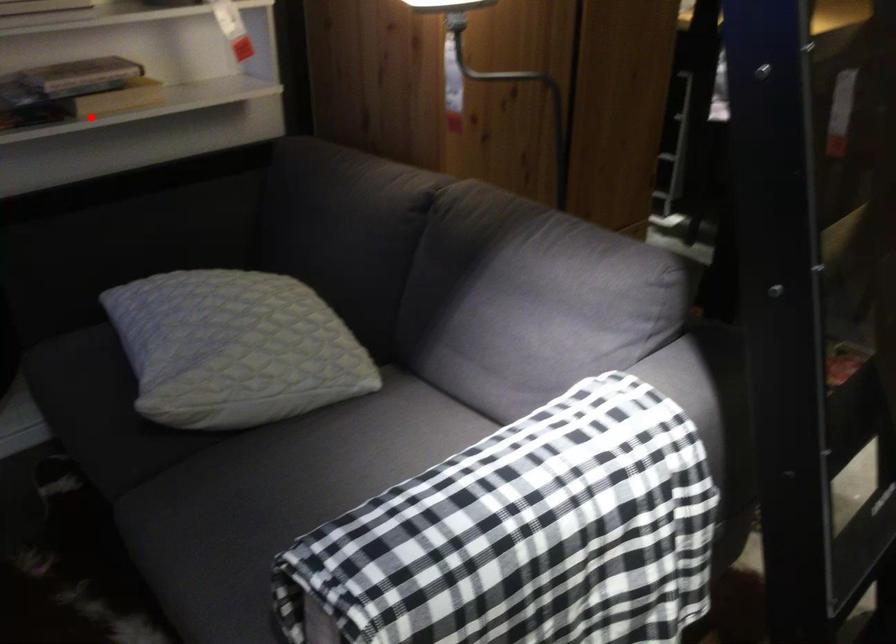
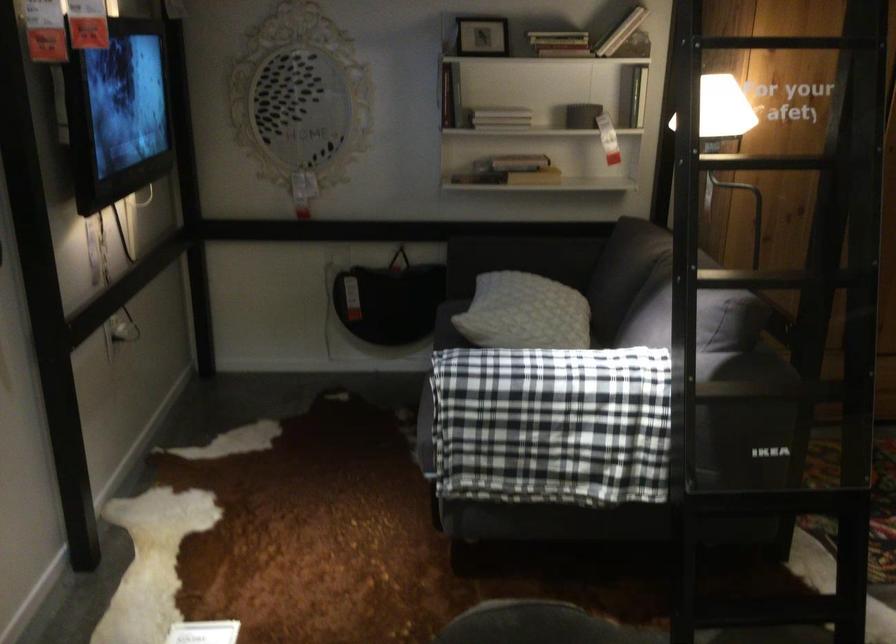
The point at the highlighted location is marked in the first image. Where is the corresponding point in the second image?

(509, 171)